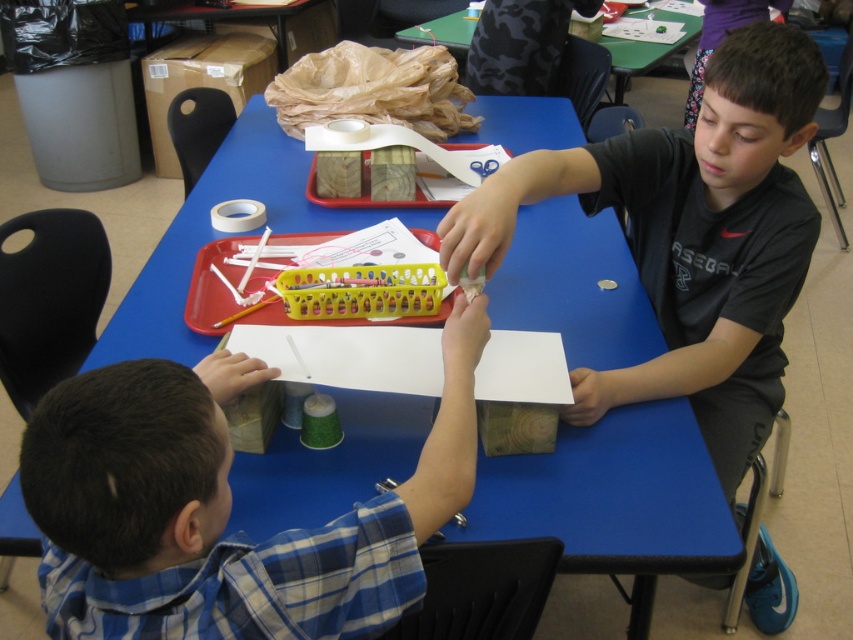
In the scene shown: You are a teacher in a classroom. You need to determine which object is bigger between the black matte shirt at upper right and the green plastic table at upper center. Which one is larger?

The black matte shirt at upper right has a larger size compared to the green plastic table at upper center, so the black matte shirt at upper right is larger.

You are standing at the camera position and want to hand a craft tool to the child wearing the black matte shirt at upper right. The tools are placed on the table between you and the child. The tool you need is 2.5 feet away from you. Is the tool within reach without moving your position?

The black matte shirt at upper right and camera are 3.83 feet apart from each other. Since the tool is only 2.5 feet away from you, it is within reach without moving your position because 2.5 feet is less than 3.83 feet.